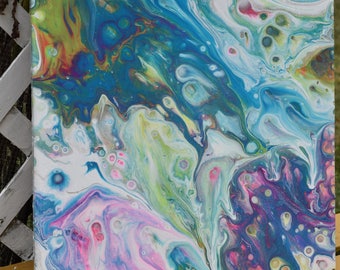
This screenshot has width=340, height=270. In order to click on light blue paint in this screenshot , I will do `click(282, 116)`.